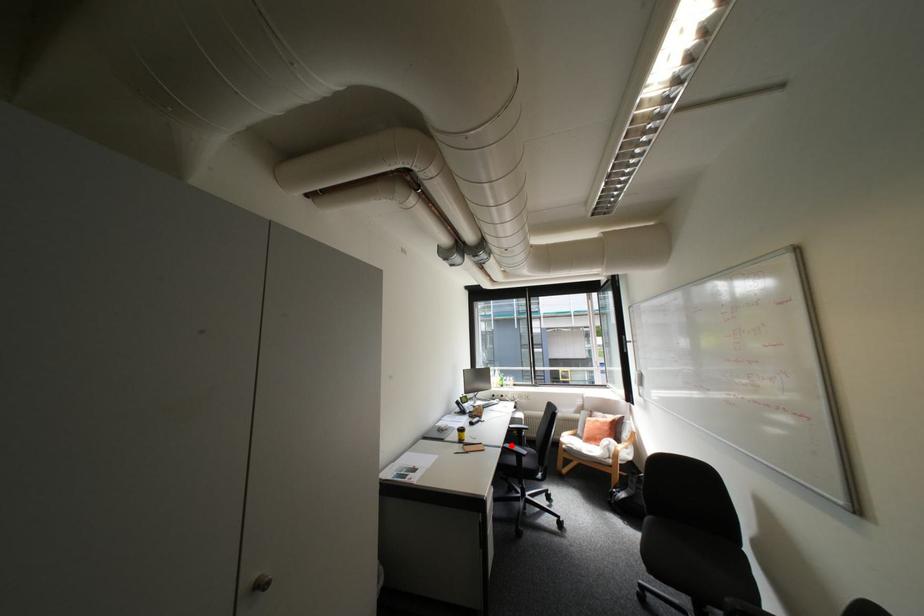
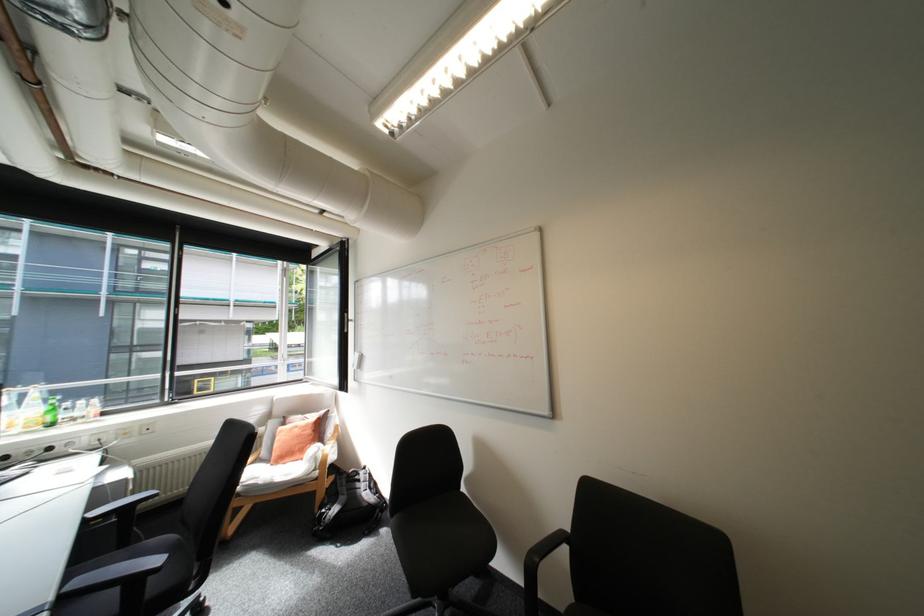
The point at the highlighted location is marked in the first image. Where is the corresponding point in the second image?

(61, 598)